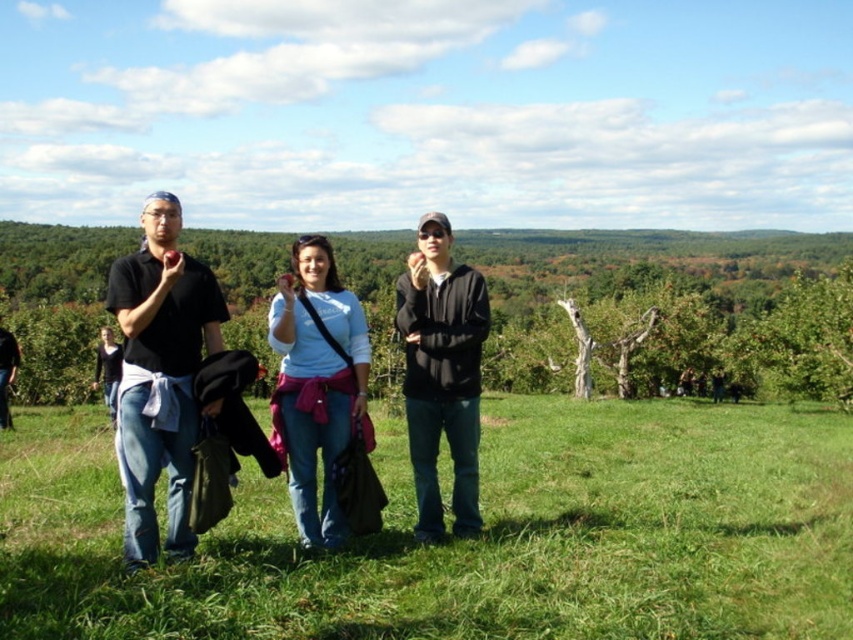
Which is in front, point (160, 236) or point (412, 474)?

Point (160, 236) is more forward.

Between matte black shirt at left and black matte jacket at center, which one is positioned higher?

black matte jacket at center is above.

Which is in front, point (216, 317) or point (477, 284)?

Point (216, 317) is in front.

Image resolution: width=853 pixels, height=640 pixels. I want to click on matte black shirt at left, so click(x=160, y=376).

Does matte black shirt at left have a lesser width compared to light blue cotton shirt at center?

Yes.

Can you confirm if matte black shirt at left is taller than light blue cotton shirt at center?

Yes.

At what (x,y) coordinates should I click in order to perform the action: click on matte black shirt at left. Please return your answer as a coordinate pair (x, y). The height and width of the screenshot is (640, 853). Looking at the image, I should click on (160, 376).

From the picture: Can you confirm if green grassy field at center is taller than black matte jacket at center?

Incorrect, green grassy field at center's height is not larger of black matte jacket at center's.

Between green grassy field at center and black matte jacket at center, which one has more height?

black matte jacket at center

Is point (496, 620) positioned in front of point (474, 358)?

Yes, point (496, 620) is in front of point (474, 358).

You are a GUI agent. You are given a task and a screenshot of the screen. Output one action in this format:
    pyautogui.click(x=<x>, y=<y>)
    Task: Click on the green grassy field at center
    The width and height of the screenshot is (853, 640).
    Given the screenshot: What is the action you would take?
    (x=469, y=540)